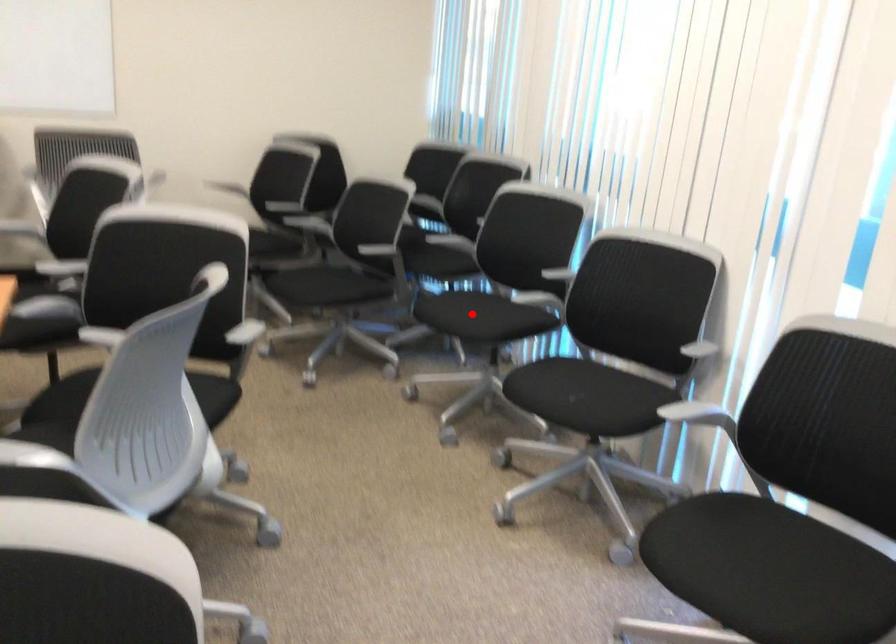
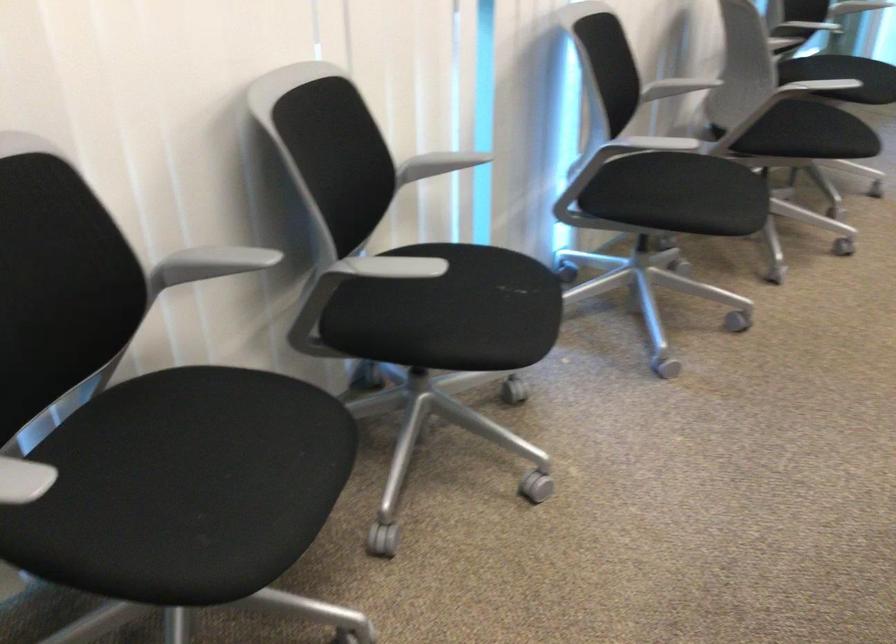
In the second image, find the point that corresponds to the highlighted location in the first image.

(226, 456)